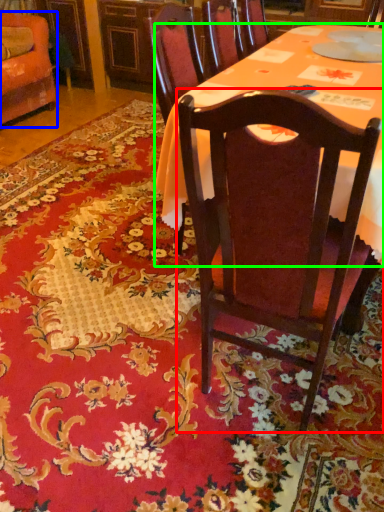
Question: Which object is the farthest from chair (highlighted by a red box)? Choose among these: chair (highlighted by a blue box) or desk (highlighted by a green box).

Choices:
 (A) chair
 (B) desk

Answer: (A)